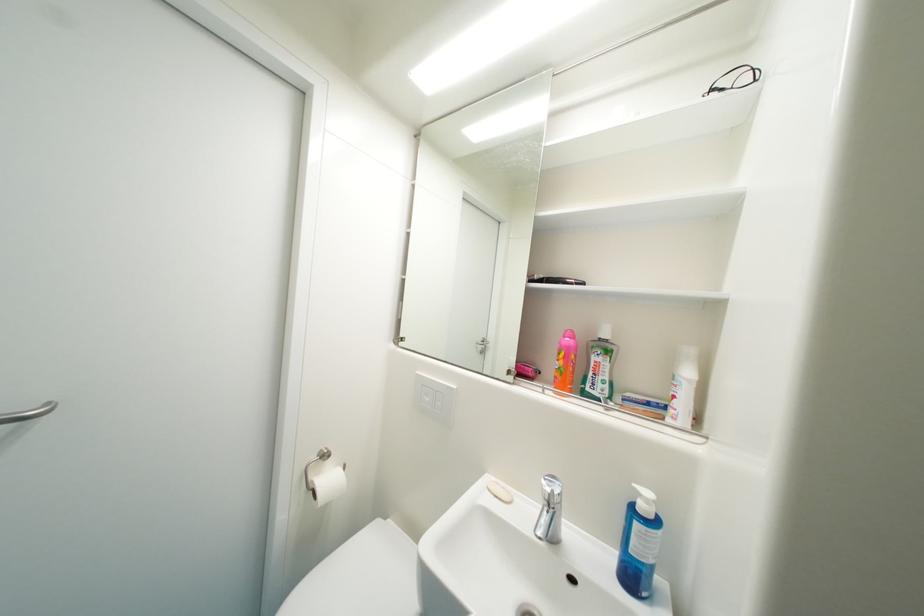
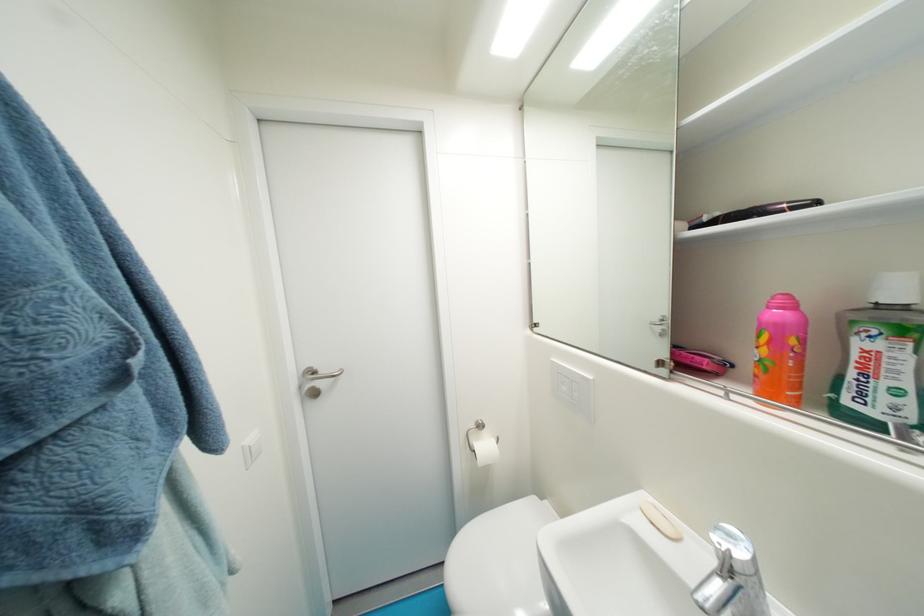
Find the pixel in the second image that matches (x=598, y=376) in the first image.

(858, 376)